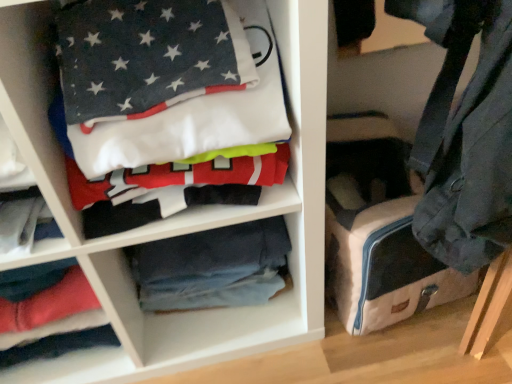
Where is `vacant space underneath dark blue cotton t-shirt at upper left (from a real-world perspective)`? Image resolution: width=512 pixels, height=384 pixels. vacant space underneath dark blue cotton t-shirt at upper left (from a real-world perspective) is located at coordinates (225, 334).